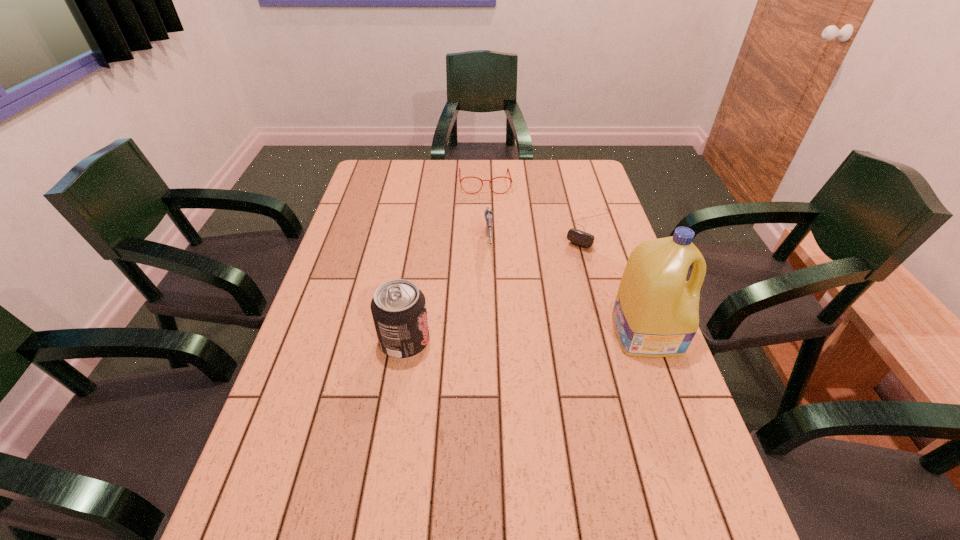
Find the location of a particular element. The image size is (960, 540). free spot on the desktop that is between the soda can and the tallest object and is positioned on the front-facing side of the webcam is located at coordinates (510, 338).

Find the location of a particular element. The height and width of the screenshot is (540, 960). vacant space on the desktop that is between the soda can and the detergent and is positioned on the face of the farthest object is located at coordinates (492, 338).

Find the location of a particular element. free space on the desktop that is between the second tallest object and the detergent and is positioned at the barrel of the gun is located at coordinates (493, 338).